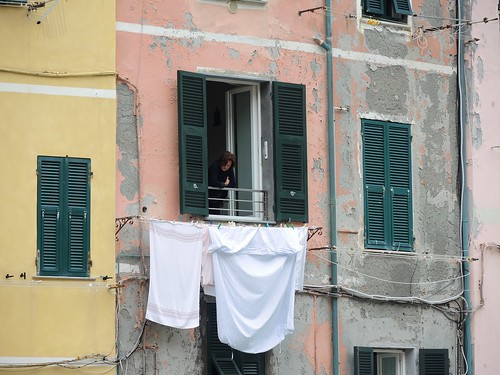
In order to click on wall in this screenshot , I will do `click(436, 198)`, `click(162, 57)`.